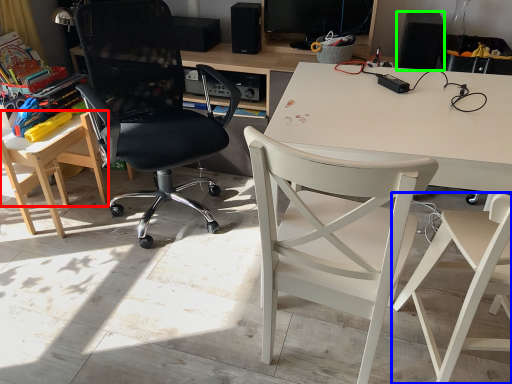
Question: Which is nearer to the table (highlighted by a red box)? chair (highlighted by a blue box) or loudspeaker (highlighted by a green box).

Choices:
 (A) chair
 (B) loudspeaker

Answer: (B)